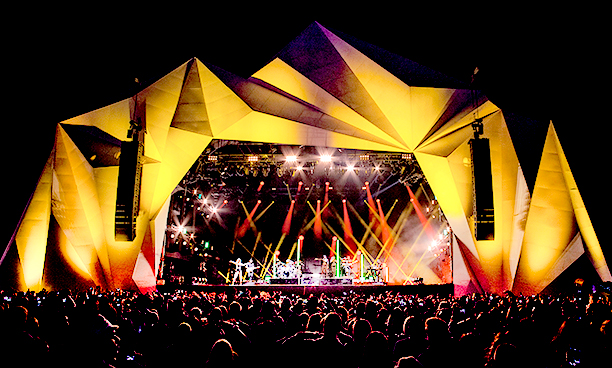
The image size is (612, 368). What are the coordinates of `speakers` in the screenshot? It's located at (474, 189), (133, 190).